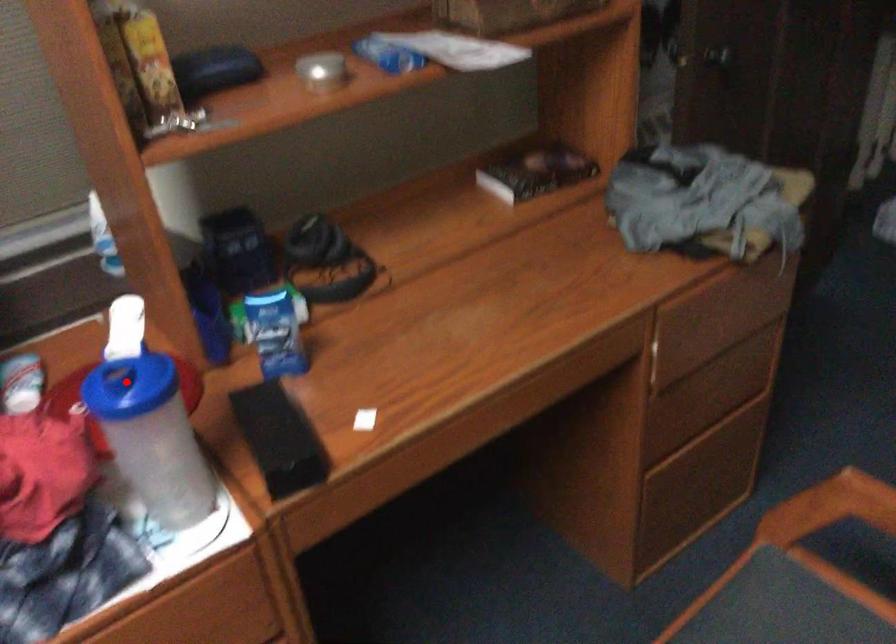
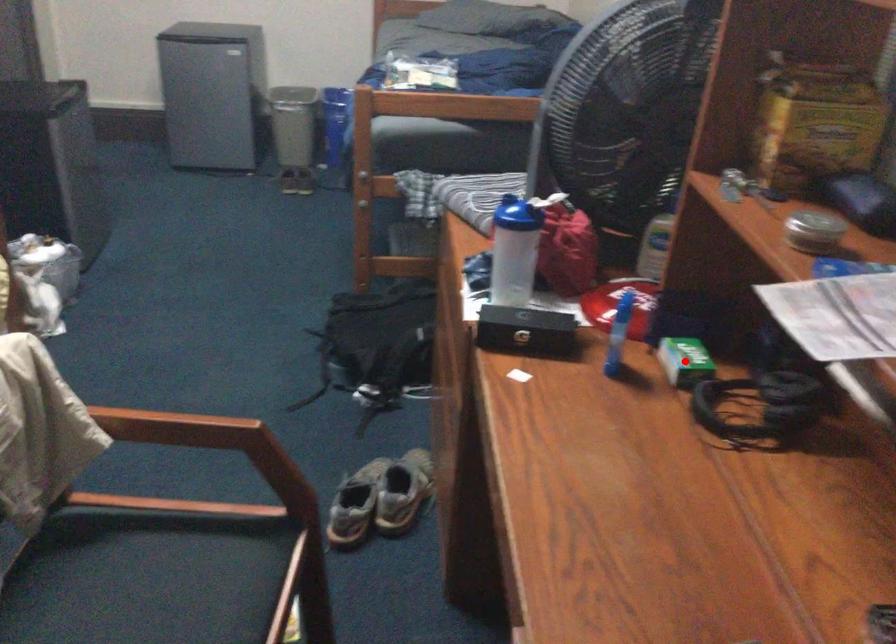
I am providing you with two images of the same scene from different viewpoints. A red point is marked on the first image and another point is marked on the second image. Is the red point in image1 aligned with the point shown in image2?

No